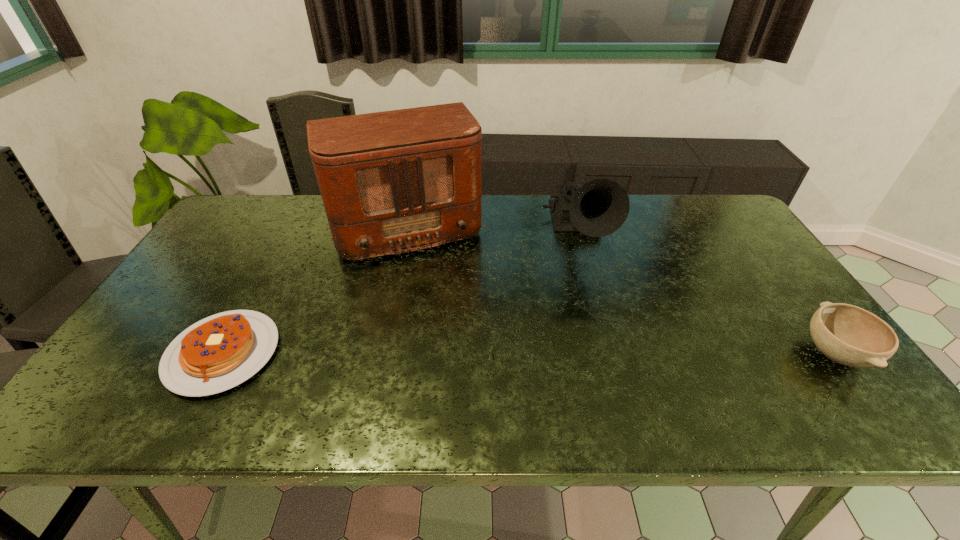
The image size is (960, 540). I want to click on vacant space that satisfies the following two spatial constraints: 1. on the front side of the third shortest object; 2. on the left side of the third tallest object, so click(612, 353).